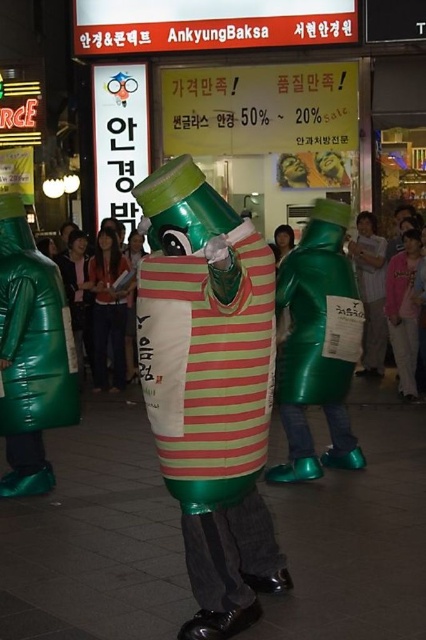
Locate an element on the screen. The image size is (426, 640). striped fabric can at center is located at coordinates (210, 388).

Can you confirm if striped fabric can at center is positioned below green shiny bottle at left?

Indeed, striped fabric can at center is positioned under green shiny bottle at left.

Who is more forward, (244, 444) or (26, 262)?

Point (244, 444) is more forward.

Find the location of `striped fabric can at center`. striped fabric can at center is located at coordinates (210, 388).

Which is below, pink fabric shirt at center or green shiny plastic bottle at center?

pink fabric shirt at center is lower down.

Is pink fabric shirt at center shorter than green shiny plastic bottle at center?

No, pink fabric shirt at center is not shorter than green shiny plastic bottle at center.

You are a GUI agent. You are given a task and a screenshot of the screen. Output one action in this format:
    pyautogui.click(x=<x>, y=<y>)
    Task: Click on the pink fabric shirt at center
    This screenshot has height=640, width=426.
    Given the screenshot: What is the action you would take?
    pyautogui.click(x=403, y=314)

Can you confirm if green shiny bottle at left is thinner than green shiny plastic bottle at center?

In fact, green shiny bottle at left might be wider than green shiny plastic bottle at center.

Locate an element on the screen. green shiny bottle at left is located at coordinates (31, 355).

Which is behind, point (22, 244) or point (377, 321)?

The point (377, 321) is more distant.

At what (x,y) coordinates should I click in order to perform the action: click on green shiny bottle at left. Please return your answer as a coordinate pair (x, y). The height and width of the screenshot is (640, 426). Looking at the image, I should click on (31, 355).